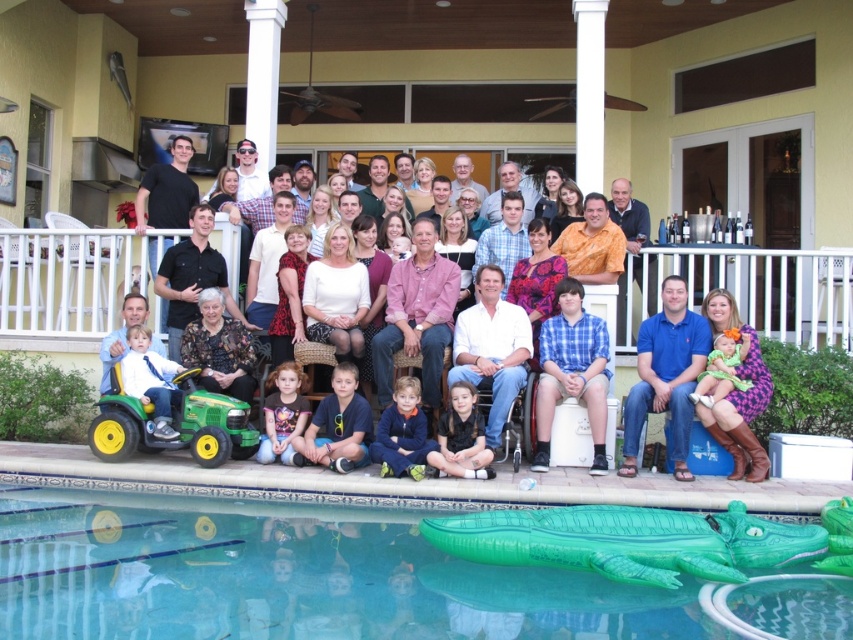
You are organizing a clothing donation drive and need to categorize items based on their size. You have two items to assess from the image described. Which of the two items, the blue cotton shirt at lower right or the dark blue fleece at center, is bigger in size?

The blue cotton shirt at lower right is larger in size compared to the dark blue fleece at center according to the description.

You are a photographer trying to capture a clear shot of the matte black clothing at center and the yellow rubber wheelchair at lower left. Based on their positions, which object is higher in the frame?

The matte black clothing at center is higher in the frame than the yellow rubber wheelchair at lower left because it is positioned above it.

You are organizing a picnic and need to choose between the white wicker basket at center and the blue cotton shirt at lower right to carry snacks. Which item is more suitable for carrying snacks based on their sizes?

The white wicker basket at center has a larger size compared to the blue cotton shirt at lower right, so it is more suitable for carrying snacks.